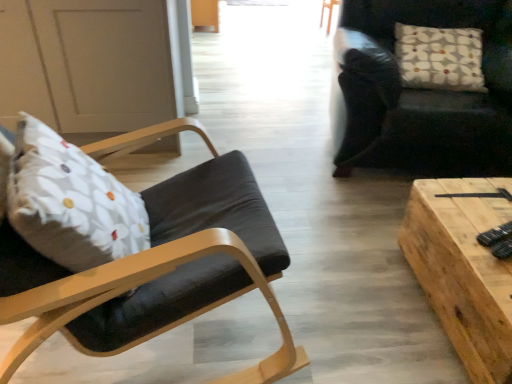
Where is `free area behind black plastic remote control at lower right`? This screenshot has width=512, height=384. free area behind black plastic remote control at lower right is located at coordinates (474, 211).